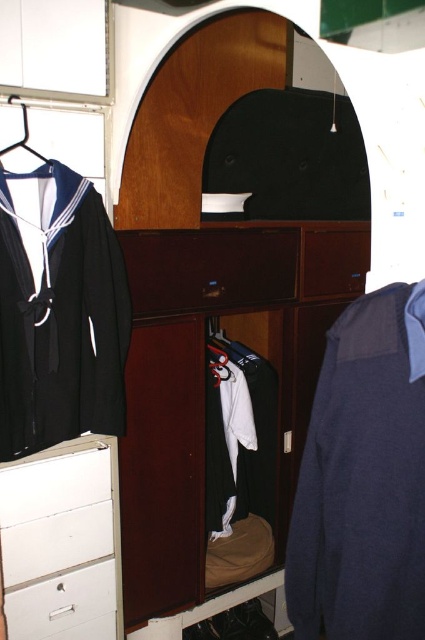
You are standing in the storage area and want to reach both points. Which point, point (62, 241) or point (65, 572), will require you to stretch further to reach?

Point (65, 572) will require stretching further because it is farther from the camera compared to point (62, 241).

You are organizing the storage area and need to place a box between the matte wood dresser at center and the white plastic drawer at lower left. Based on their positions, where should you place the box?

Since the matte wood dresser at center is to the right of the white plastic drawer at lower left, you should place the box between them, positioning it to the right of the white plastic drawer at lower left and to the left of the matte wood dresser at center.

Looking at this image, you are organizing the storage area and need to move the sailor blue fabric jacket at left and the white painted wood file cabinet at lower left. Which object is positioned to the right of the other?

The sailor blue fabric jacket at left is to the right of the white painted wood file cabinet at lower left.